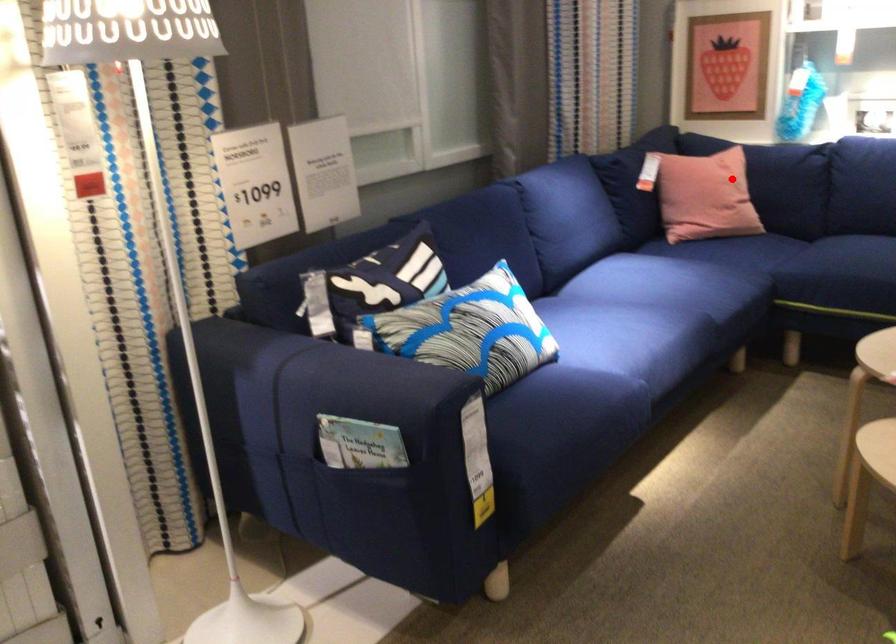
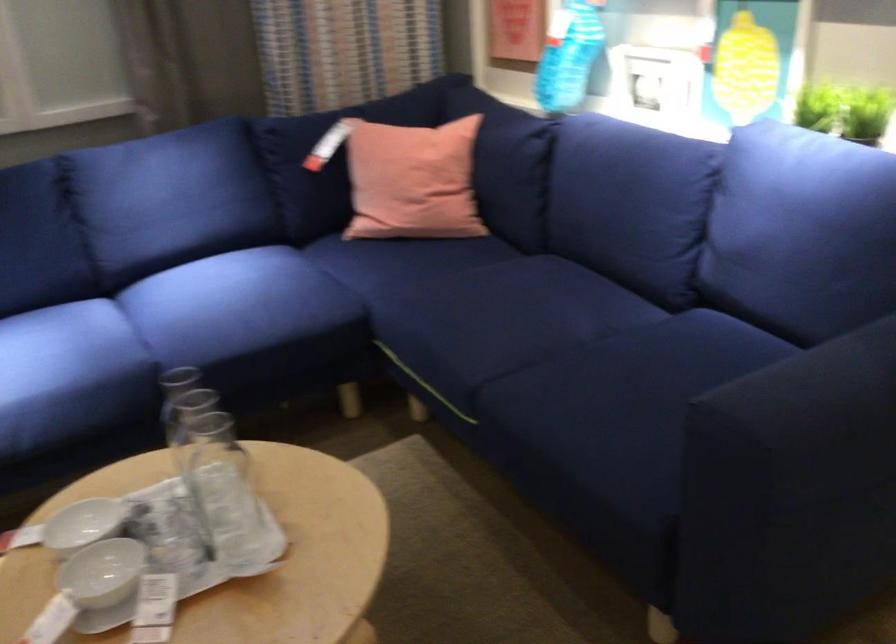
Question: I am providing you with two images of the same scene from different viewpoints. A red point is marked on the first image. At the location where the point appears in image 1, is it still visible in image 2?

Choices:
 (A) Yes
 (B) No

Answer: (A)